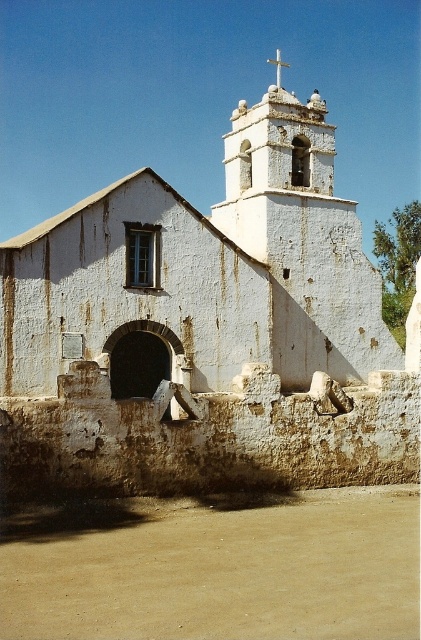
You are standing in front of the old church and want to place a small flowerpot between the brown sandy dirt at lower center and the white stone cross at upper center. Can you determine which object is closer to you so you know where to place it?

The brown sandy dirt at lower center is closer to the viewer than the white stone cross at upper center, so you should place the flowerpot closer to the brown sandy dirt at lower center.

You are standing in front of the old church and notice two points marked on the facade. The first point is at coordinate point(221, 262) and the second at point(279, 76). Which point is closer to you?

Point(221, 262) is in front of point(279, 76), so it is closer to you.